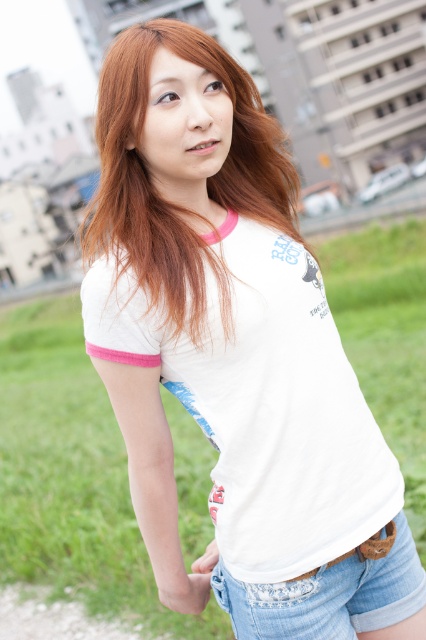
Is blonde hair at center further to camera compared to denim shorts at lower right?

No, blonde hair at center is in front of denim shorts at lower right.

Is blonde hair at center thinner than denim shorts at lower right?

Incorrect, blonde hair at center's width is not less than denim shorts at lower right's.

You are a GUI agent. You are given a task and a screenshot of the screen. Output one action in this format:
    pyautogui.click(x=<x>, y=<y>)
    Task: Click on the blonde hair at center
    The width and height of the screenshot is (426, 640).
    Given the screenshot: What is the action you would take?
    pyautogui.click(x=206, y=182)

Image resolution: width=426 pixels, height=640 pixels. I want to click on blonde hair at center, so click(206, 182).